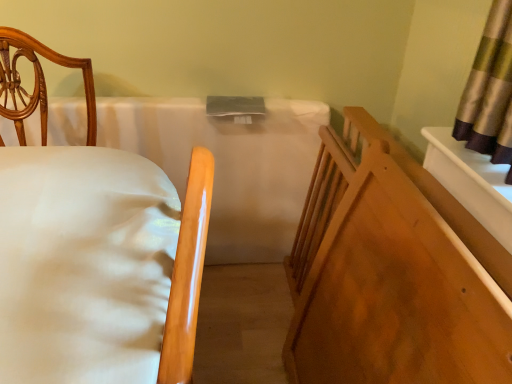
Question: In the image, is white smooth mattress at center positioned in front of or behind white fabric bed at left?

Choices:
 (A) behind
 (B) front

Answer: (A)

Question: From a real-world perspective, is white smooth mattress at center physically located above or below white fabric bed at left?

Choices:
 (A) below
 (B) above

Answer: (A)

Question: Which is nearer to the white fabric bed at left?

Choices:
 (A) smooth wood crib at right
 (B) white smooth mattress at center

Answer: (A)

Question: Which object is positioned farthest from the white smooth mattress at center?

Choices:
 (A) white fabric bed at left
 (B) smooth wood crib at right

Answer: (A)